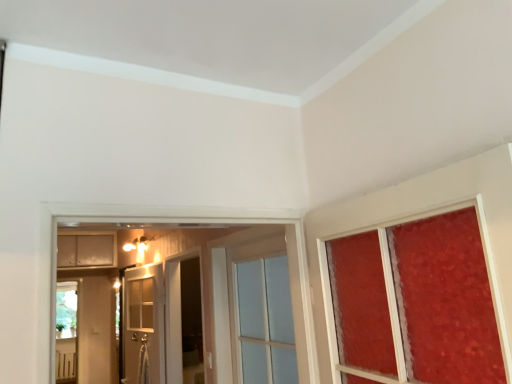
Question: Looking at the image, does clear glass door at center, which is the 1th door from front to back, seem bigger or smaller compared to transparent glass screen door at center?

Choices:
 (A) small
 (B) big

Answer: (A)

Question: From their relative heights in the image, would you say clear glass door at center, which is the 1th door from front to back, is taller or shorter than transparent glass screen door at center?

Choices:
 (A) tall
 (B) short

Answer: (B)

Question: Estimate the real-world distances between objects in this image. Which object is closer to the clear glass door at center, the second door positioned from the left?

Choices:
 (A) white glass door at center, the 2th door when ordered from right to left
 (B) matte white cabinet at upper left
 (C) transparent glass screen door at center

Answer: (C)

Question: Considering the real-world distances, which object is farthest from the matte white cabinet at upper left?

Choices:
 (A) transparent glass screen door at center
 (B) clear glass door at center, placed as the second door when sorted from back to front
 (C) white glass door at center, placed as the second door when sorted from front to back

Answer: (B)